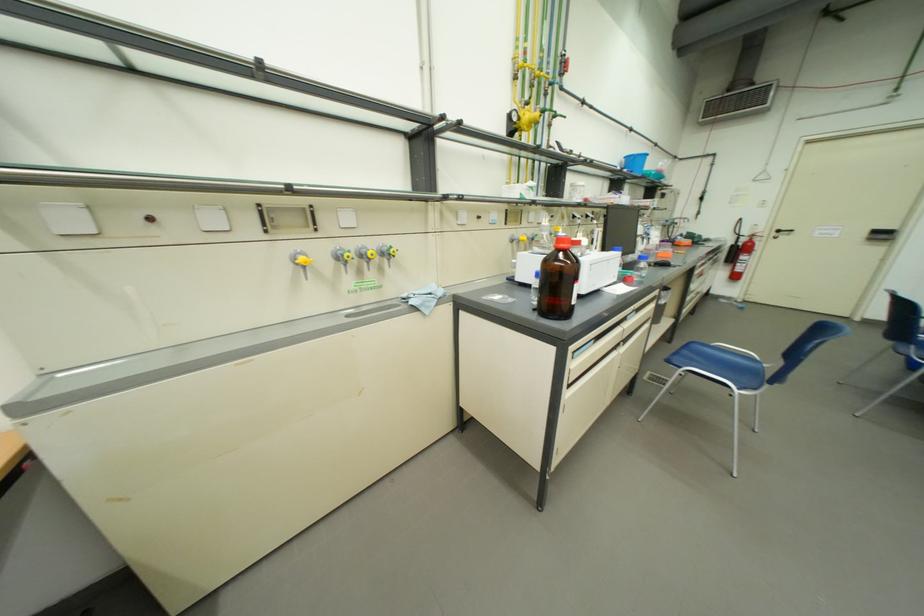
Find the location of `yellow valve wheel`. yellow valve wheel is located at coordinates (302, 260).